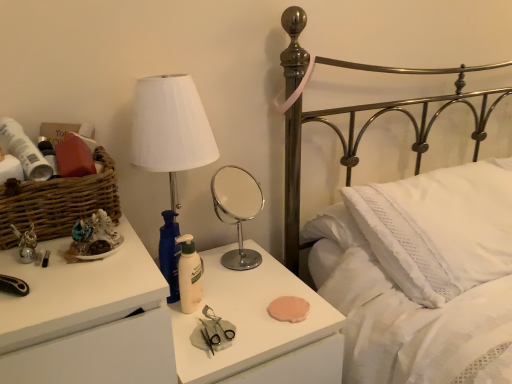
You are a GUI agent. You are given a task and a screenshot of the screen. Output one action in this format:
    pyautogui.click(x=<x>, y=<y>)
    Task: Click on the vacant area that is in front of white fabric lampshade at upper left
    
    Given the screenshot: What is the action you would take?
    pyautogui.click(x=214, y=311)